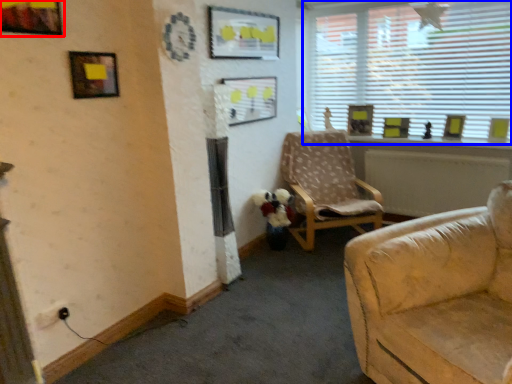
Question: Which of the following is the farthest to the observer, picture frame (highlighted by a red box) or window (highlighted by a blue box)?

Choices:
 (A) picture frame
 (B) window

Answer: (B)